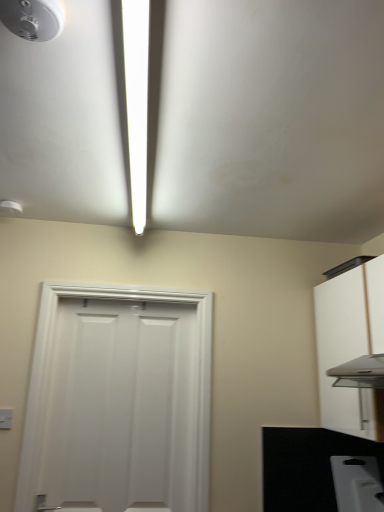
Question: Considering the positions of point (130, 485) and point (142, 25), is point (130, 485) closer or farther from the camera than point (142, 25)?

Choices:
 (A) closer
 (B) farther

Answer: (B)

Question: In terms of size, does white matte door at center appear bigger or smaller than white glossy light fixture at upper center?

Choices:
 (A) big
 (B) small

Answer: (A)

Question: Estimate the real-world distances between objects in this image. Which object is farther from the white matte cabinet at right?

Choices:
 (A) white plastic toaster at lower right
 (B) white plastic light switch at lower left
 (C) white plastic smoke detector at upper left
 (D) black matte countertop at lower right
 (E) white glossy light fixture at upper center

Answer: (C)

Question: Which of these objects is positioned closest to the white plastic light switch at lower left?

Choices:
 (A) white glossy light fixture at upper center
 (B) white plastic toaster at lower right
 (C) white plastic smoke detector at upper left
 (D) white matte door at center
 (E) black matte countertop at lower right

Answer: (D)